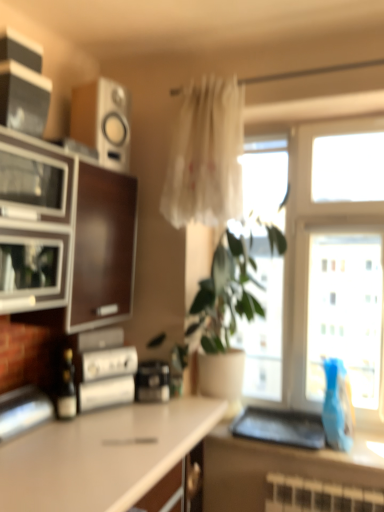
Question: From a real-world perspective, is white matte countertop at lower left, arranged as the second countertop when viewed from the top, positioned over wooden/matte speaker at upper left, the 4th appliance positioned from the bottom, based on gravity?

Choices:
 (A) no
 (B) yes

Answer: (A)

Question: Is white matte countertop at lower left, the second countertop from the right, closer to the viewer compared to wooden/matte speaker at upper left, which ranks as the first appliance in top-to-bottom order?

Choices:
 (A) no
 (B) yes

Answer: (B)

Question: From the image's perspective, is white matte countertop at lower left, arranged as the second countertop when viewed from the top, over wooden/matte speaker at upper left, the 4th appliance positioned from the bottom?

Choices:
 (A) no
 (B) yes

Answer: (A)

Question: Is white matte countertop at lower left, the second countertop from the right, completely or partially outside of wooden/matte speaker at upper left, the 4th appliance positioned from the bottom?

Choices:
 (A) yes
 (B) no

Answer: (A)

Question: Is white matte countertop at lower left, marked as the first countertop in a left-to-right arrangement, wider than wooden/matte speaker at upper left, the 4th appliance positioned from the bottom?

Choices:
 (A) no
 (B) yes

Answer: (B)

Question: Does white matte countertop at lower left, arranged as the 1th countertop when ordered from the bottom, have a larger size compared to wooden/matte speaker at upper left, which ranks as the first appliance in top-to-bottom order?

Choices:
 (A) yes
 (B) no

Answer: (A)

Question: Is metallic silver toaster at left, which is the fourth appliance in top-to-bottom order, behind wooden/matte speaker at upper left, the 4th appliance positioned from the bottom?

Choices:
 (A) no
 (B) yes

Answer: (A)

Question: Is metallic silver toaster at left, which is the fourth appliance in top-to-bottom order, not near wooden/matte speaker at upper left, which ranks as the first appliance in top-to-bottom order?

Choices:
 (A) no
 (B) yes

Answer: (B)

Question: Does metallic silver toaster at left, which is the fourth appliance in top-to-bottom order, touch wooden/matte speaker at upper left, which ranks as the first appliance in top-to-bottom order?

Choices:
 (A) yes
 (B) no

Answer: (B)

Question: Can you confirm if metallic silver toaster at left, positioned as the 1th appliance in bottom-to-top order, is thinner than wooden/matte speaker at upper left, the 4th appliance positioned from the bottom?

Choices:
 (A) yes
 (B) no

Answer: (A)

Question: Is metallic silver toaster at left, positioned as the 1th appliance in bottom-to-top order, to the left of wooden/matte speaker at upper left, the 4th appliance positioned from the bottom, from the viewer's perspective?

Choices:
 (A) yes
 (B) no

Answer: (A)

Question: Does metallic silver toaster at left, which is the fourth appliance in top-to-bottom order, turn towards wooden/matte speaker at upper left, which ranks as the first appliance in top-to-bottom order?

Choices:
 (A) yes
 (B) no

Answer: (B)

Question: Considering the relative sizes of white matte countertop at lower left, arranged as the second countertop when viewed from the top, and smooth brown countertop at lower right, which is the first countertop from right to left, in the image provided, is white matte countertop at lower left, arranged as the second countertop when viewed from the top, shorter than smooth brown countertop at lower right, which is the first countertop from right to left,?

Choices:
 (A) no
 (B) yes

Answer: (A)